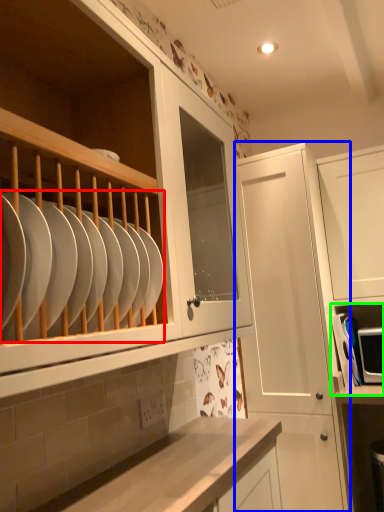
Question: Estimate the real-world distances between objects in this image. Which object is closer to tableware (highlighted by a red box), cabinetry (highlighted by a blue box) or shelf (highlighted by a green box)?

Choices:
 (A) cabinetry
 (B) shelf

Answer: (A)